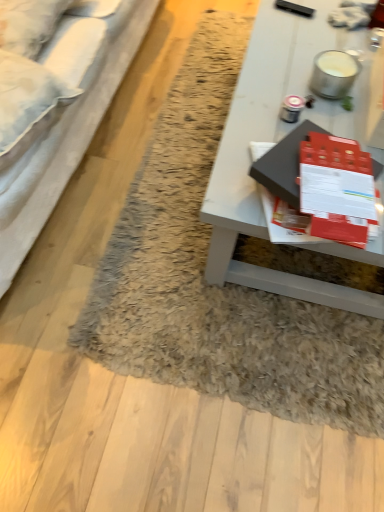
The image size is (384, 512). I want to click on vacant space situated on the left part of white glossy table at center, so click(170, 172).